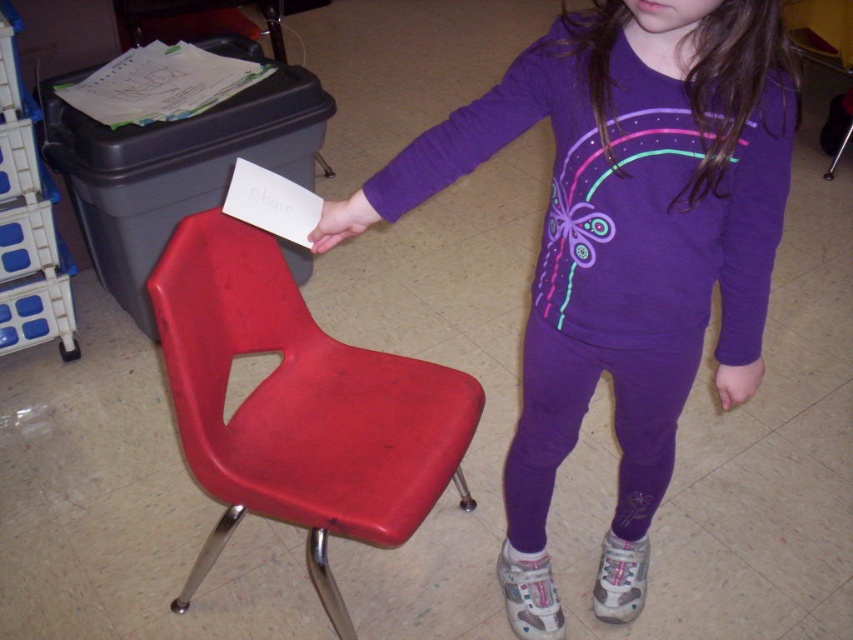
Question: Which point is closer to the camera?

Choices:
 (A) matte plastic chair at left
 (B) purple matte hand at lower right
 (C) matte plastic hand at center
 (D) purple fleece sweatshirt at upper center

Answer: (D)

Question: Is matte plastic chair at left above purple matte hand at lower right?

Choices:
 (A) no
 (B) yes

Answer: (A)

Question: Which point is farther to the camera?

Choices:
 (A) purple matte hand at lower right
 (B) purple fleece sweatshirt at upper center
 (C) matte plastic hand at center

Answer: (A)

Question: Which of these objects is positioned farthest from the matte plastic chair at left?

Choices:
 (A) purple fleece sweatshirt at upper center
 (B) matte plastic hand at center
 (C) purple matte hand at lower right

Answer: (C)

Question: Considering the relative positions of matte plastic chair at left and purple matte hand at lower right in the image provided, where is matte plastic chair at left located with respect to purple matte hand at lower right?

Choices:
 (A) right
 (B) left

Answer: (B)

Question: Is matte plastic chair at left thinner than purple matte hand at lower right?

Choices:
 (A) no
 (B) yes

Answer: (A)